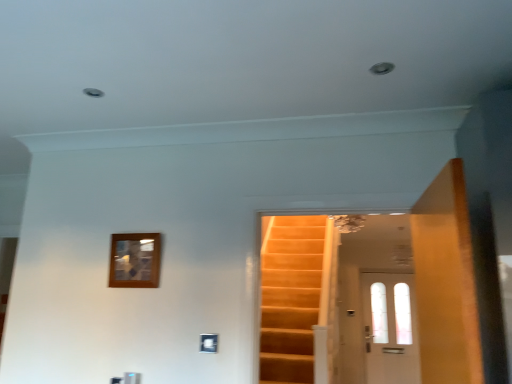
Question: Which direction should I rotate to look at white glass door at center, which appears as the second door when viewed from the left?

Choices:
 (A) left
 (B) right

Answer: (B)

Question: Can you confirm if wooden picture frame at upper left is smaller than wooden door at right, which is counted as the second door, starting from the back?

Choices:
 (A) no
 (B) yes

Answer: (B)

Question: Is wooden picture frame at upper left facing towards wooden door at right, which is the second door in bottom-to-top order?

Choices:
 (A) yes
 (B) no

Answer: (B)

Question: From a real-world perspective, is wooden picture frame at upper left under wooden door at right, positioned as the 1th door in left-to-right order?

Choices:
 (A) yes
 (B) no

Answer: (B)

Question: From the image's perspective, is wooden picture frame at upper left located above wooden door at right, placed as the 1th door when sorted from front to back?

Choices:
 (A) no
 (B) yes

Answer: (A)

Question: Is wooden picture frame at upper left not within wooden door at right, positioned as the 1th door in left-to-right order?

Choices:
 (A) yes
 (B) no

Answer: (A)

Question: Considering the relative sizes of wooden picture frame at upper left and wooden door at right, which is counted as the second door, starting from the back, in the image provided, is wooden picture frame at upper left taller than wooden door at right, which is counted as the second door, starting from the back,?

Choices:
 (A) no
 (B) yes

Answer: (A)

Question: Does white glass door at center, marked as the first door in a right-to-left arrangement, appear on the right side of wooden picture frame at upper left?

Choices:
 (A) yes
 (B) no

Answer: (A)

Question: Considering the relative positions of white glass door at center, arranged as the second door when viewed from the front, and wooden picture frame at upper left in the image provided, is white glass door at center, arranged as the second door when viewed from the front, to the left of wooden picture frame at upper left from the viewer's perspective?

Choices:
 (A) yes
 (B) no

Answer: (B)

Question: From a real-world perspective, does white glass door at center, which is the 1th door from bottom to top, stand above wooden picture frame at upper left?

Choices:
 (A) no
 (B) yes

Answer: (A)

Question: From the image's perspective, is white glass door at center, which is counted as the first door, starting from the back, under wooden picture frame at upper left?

Choices:
 (A) no
 (B) yes

Answer: (B)

Question: Is white glass door at center, arranged as the second door when viewed from the front, oriented away from wooden picture frame at upper left?

Choices:
 (A) yes
 (B) no

Answer: (B)

Question: Is white glass door at center, which is the 1th door from bottom to top, shorter than wooden picture frame at upper left?

Choices:
 (A) yes
 (B) no

Answer: (B)

Question: From a real-world perspective, is white glass door at center, arranged as the second door when viewed from the front, positioned under wooden door at right, which is counted as the second door, starting from the back, based on gravity?

Choices:
 (A) yes
 (B) no

Answer: (A)